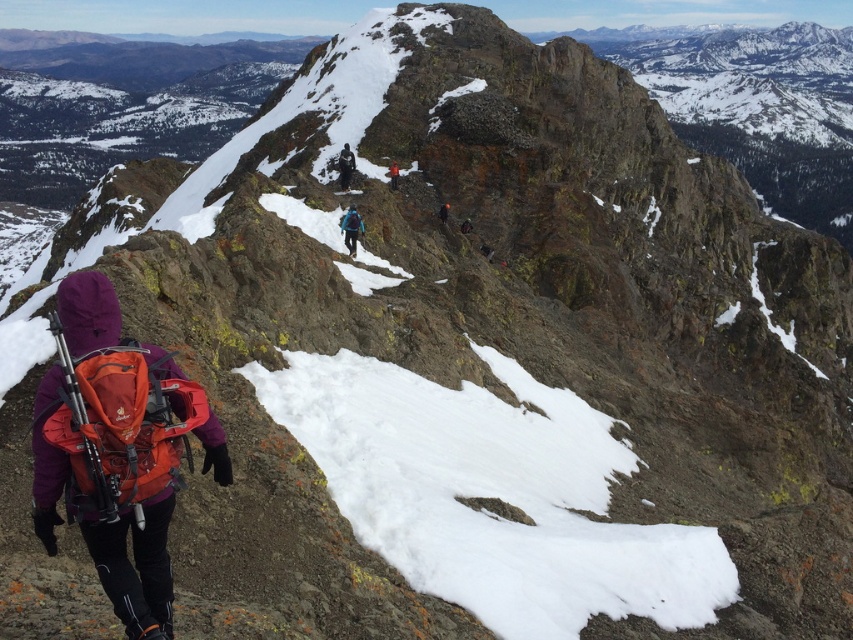
You are a hiker planning to follow the path taken by the person in the image. The path is marked by two points, point 1 at coordinates point 1 at coordinates point (x=347, y=218) and point 2 at coordinates point (x=466, y=230). Which point should you step on first to stay on the correct path?

Point 1 at coordinates point (x=347, y=218) is in front of point 2 at coordinates point (x=466, y=230), so you should step on point 1 at coordinates point (x=347, y=218) first to stay on the correct path.

You are a hiker looking at the mountain path ahead. You see a dark blue jacket at center and an orange fabric jacket at center. Which jacket is closer to you?

The dark blue jacket at center is closer to you because it is in front of the orange fabric jacket at center.

You are a hiker who needs to locate your blue fabric backpack at center and matte blue jacket at center. According to the scene, which one is positioned more to the left?

The blue fabric backpack at center is positioned to the left of the matte blue jacket at center, so the blue fabric backpack at center is more to the left.